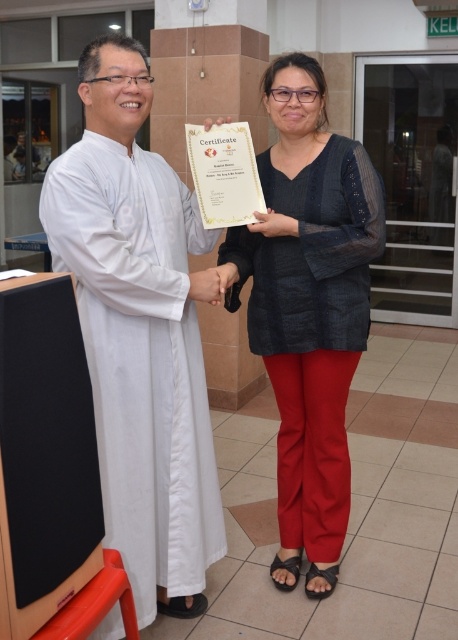
Question: Is white clothed man at left positioned in front of matte black blouse at center?

Choices:
 (A) no
 (B) yes

Answer: (B)

Question: Is white clothed man at left positioned behind matte black blouse at center?

Choices:
 (A) no
 (B) yes

Answer: (A)

Question: Does white clothed man at left have a greater width compared to matte black blouse at center?

Choices:
 (A) yes
 (B) no

Answer: (B)

Question: Which point appears farthest from the camera in this image?

Choices:
 (A) (86, 81)
 (B) (283, 570)

Answer: (B)